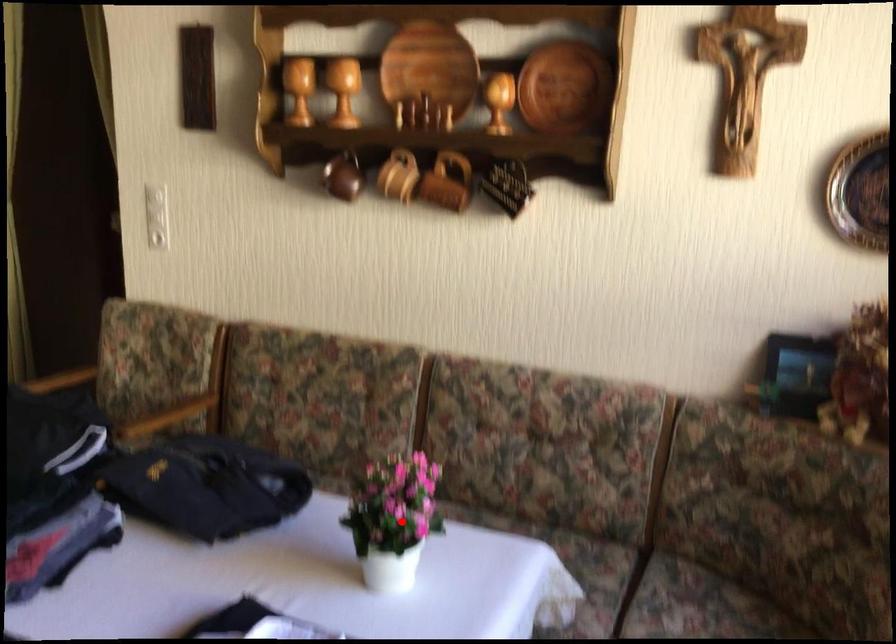
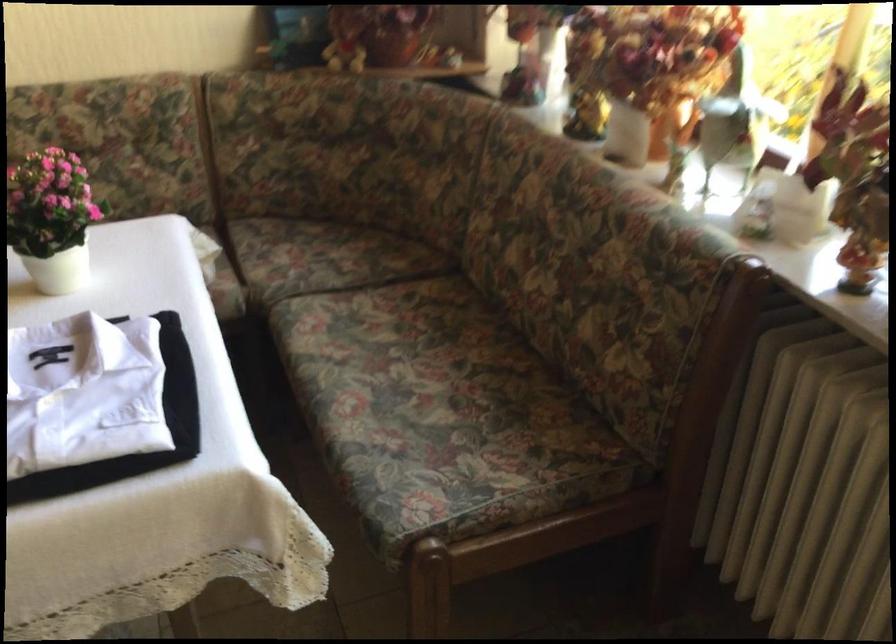
In the second image, find the point that corresponds to the highlighted location in the first image.

(52, 218)